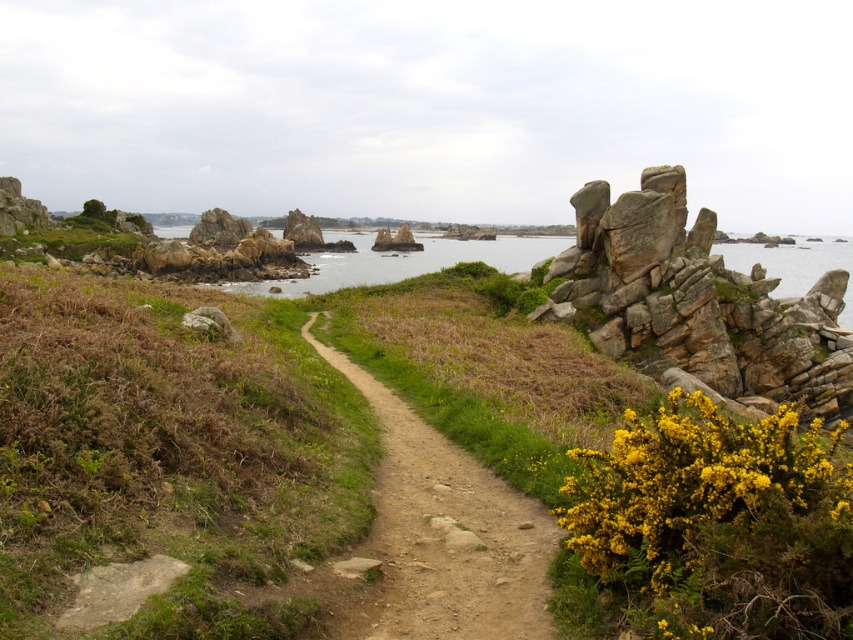
You are standing at the starting point of the narrow dirt path in the coastal landscape. You want to reach the yellow fluffy bush at right. In which direction should you walk relative to the path?

The yellow fluffy bush at right is located at coordinates [714,502], which is to the right side of the path. Therefore, you should walk towards the right side of the path to reach it.